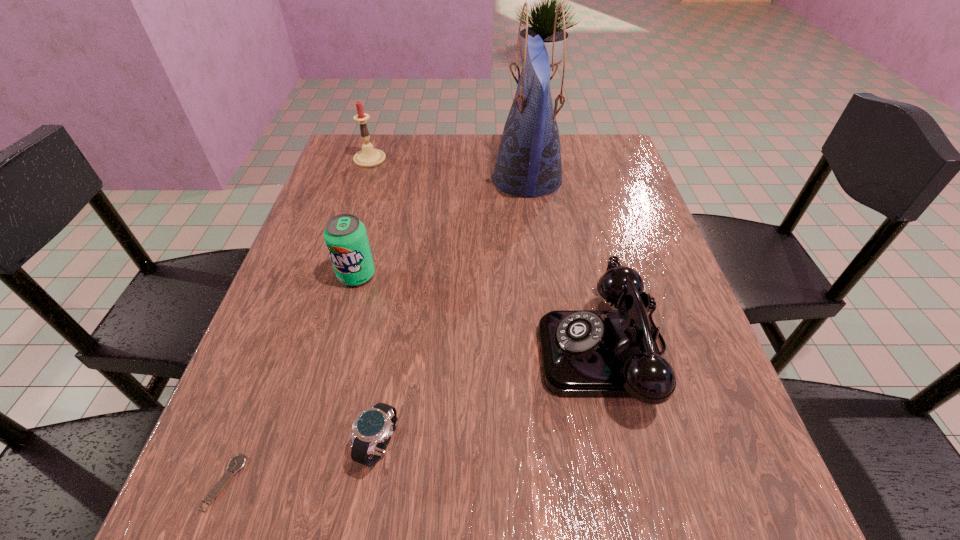
Where is `free space between the telephone and the shopping bag`? free space between the telephone and the shopping bag is located at coordinates 566,265.

Find the location of a particular element. The width and height of the screenshot is (960, 540). vacant area between the fourth nearest object and the tallest object is located at coordinates (442, 227).

Locate an element on the screen. This screenshot has height=540, width=960. free space that is in between the second shortest object and the second tallest object is located at coordinates (375, 302).

Locate which object ranks fifth in proximity to the shopping bag. Please provide its 2D coordinates. Your answer should be formatted as a tuple, i.e. [(x, y)], where the tuple contains the x and y coordinates of a point satisfying the conditions above.

[(238, 462)]

Identify which object is located as the second nearest to the third farthest object. Please provide its 2D coordinates. Your answer should be formatted as a tuple, i.e. [(x, y)], where the tuple contains the x and y coordinates of a point satisfying the conditions above.

[(528, 163)]